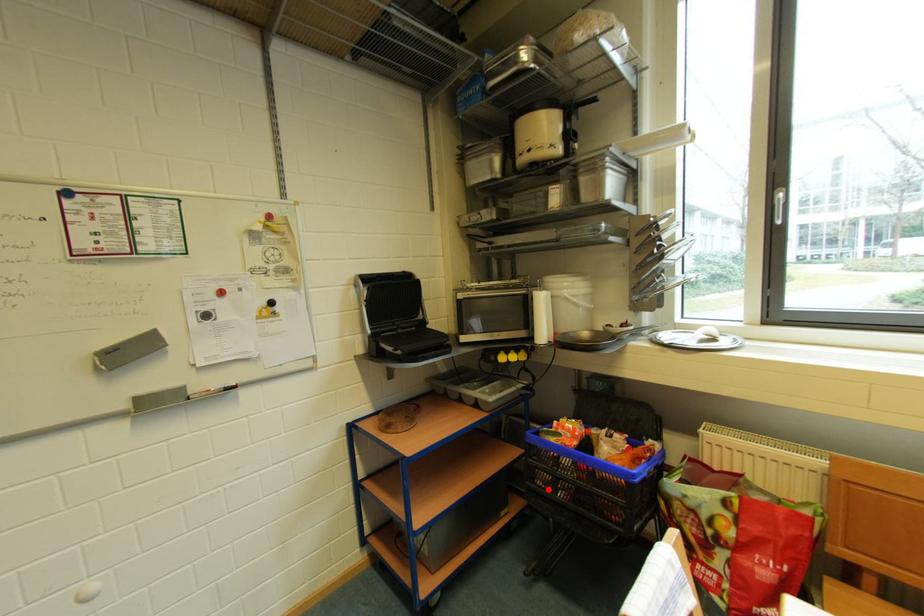
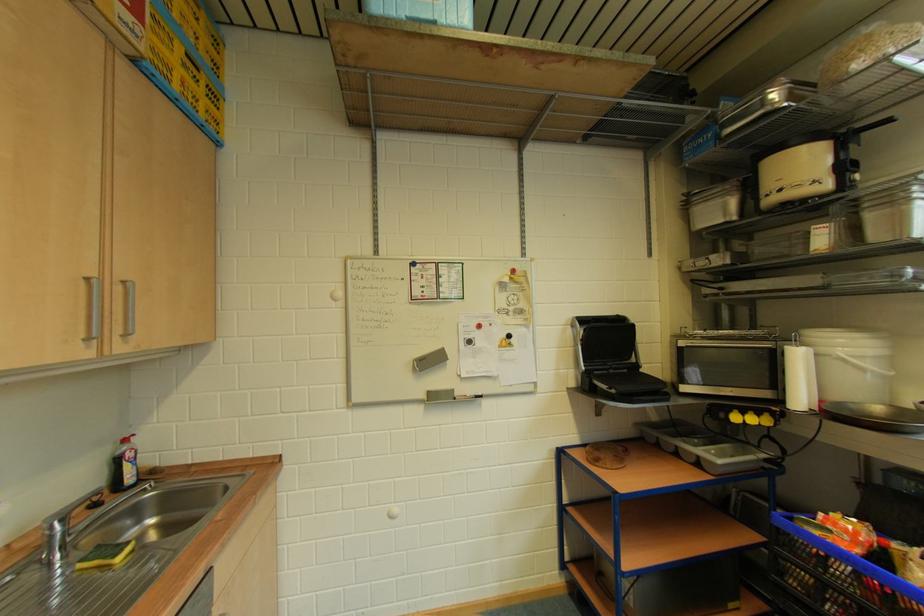
The point at the highlighted location is marked in the first image. Where is the corresponding point in the second image?

(803, 591)